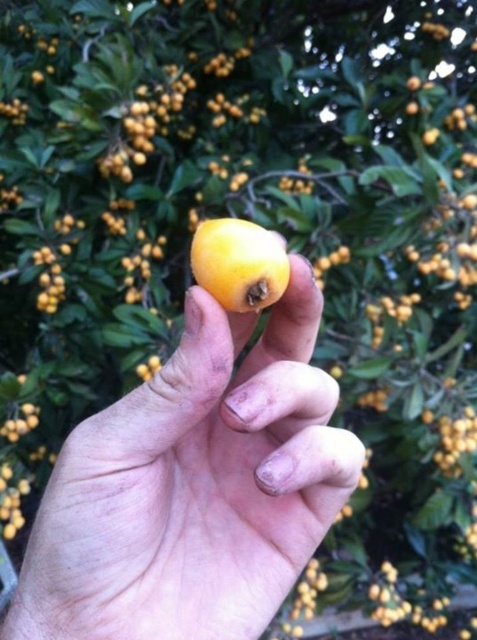
Question: Among these points, which one is nearest to the camera?

Choices:
 (A) (253, 246)
 (B) (197, 600)

Answer: (A)

Question: Where is yellow matte fruit at center located in relation to yellow matte/orange at center in the image?

Choices:
 (A) above
 (B) below

Answer: (B)

Question: Which object is farther from the camera taking this photo?

Choices:
 (A) yellow matte fruit at center
 (B) yellow matte/orange at center

Answer: (B)

Question: Does yellow matte fruit at center appear over yellow matte/orange at center?

Choices:
 (A) yes
 (B) no

Answer: (B)

Question: Can you confirm if yellow matte fruit at center is bigger than yellow matte/orange at center?

Choices:
 (A) yes
 (B) no

Answer: (A)

Question: Which object appears closest to the camera in this image?

Choices:
 (A) yellow matte/orange at center
 (B) yellow matte fruit at center

Answer: (B)